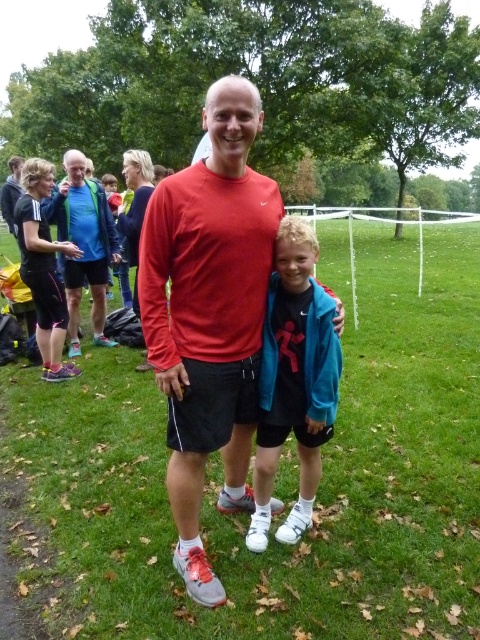
Question: Among these points, which one is farthest from the camera?

Choices:
 (A) (222, 280)
 (B) (72, 540)
 (C) (300, 392)

Answer: (B)

Question: Considering the relative positions of matte red long-sleeve shirt at center and blue fabric jacket at center in the image provided, where is matte red long-sleeve shirt at center located with respect to blue fabric jacket at center?

Choices:
 (A) above
 (B) below

Answer: (A)

Question: Estimate the real-world distances between objects in this image. Which object is closer to the matte black shorts at left?

Choices:
 (A) matte blue jacket at left
 (B) green grass football field at center

Answer: (A)

Question: Does green grass football field at center appear on the left side of blue fabric jacket at center?

Choices:
 (A) yes
 (B) no

Answer: (B)

Question: Which of the following is the closest to the observer?

Choices:
 (A) matte blue jacket at left
 (B) matte black shorts at left
 (C) blue fabric jacket at center

Answer: (C)

Question: Where is green grass football field at center located in relation to matte red long-sleeve shirt at center in the image?

Choices:
 (A) below
 (B) above

Answer: (B)